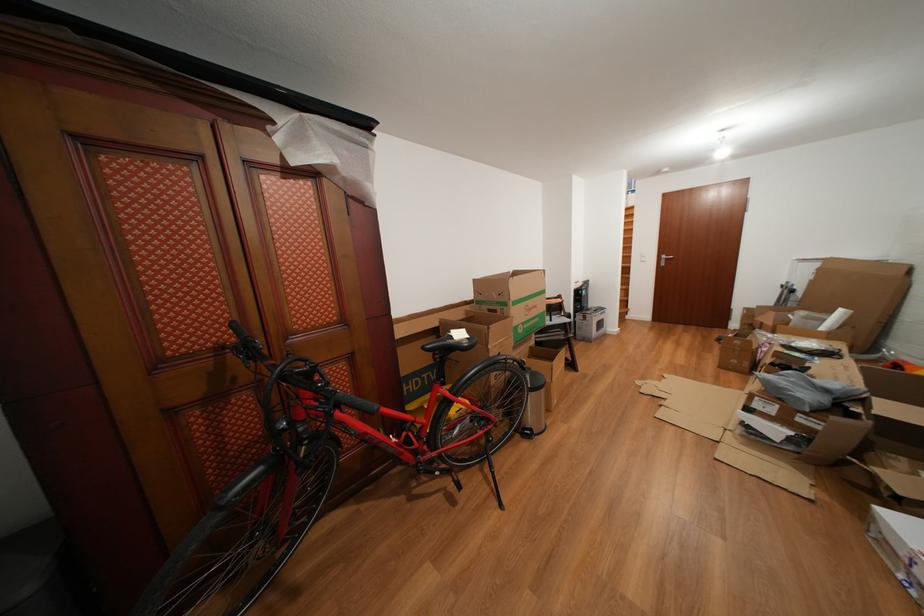
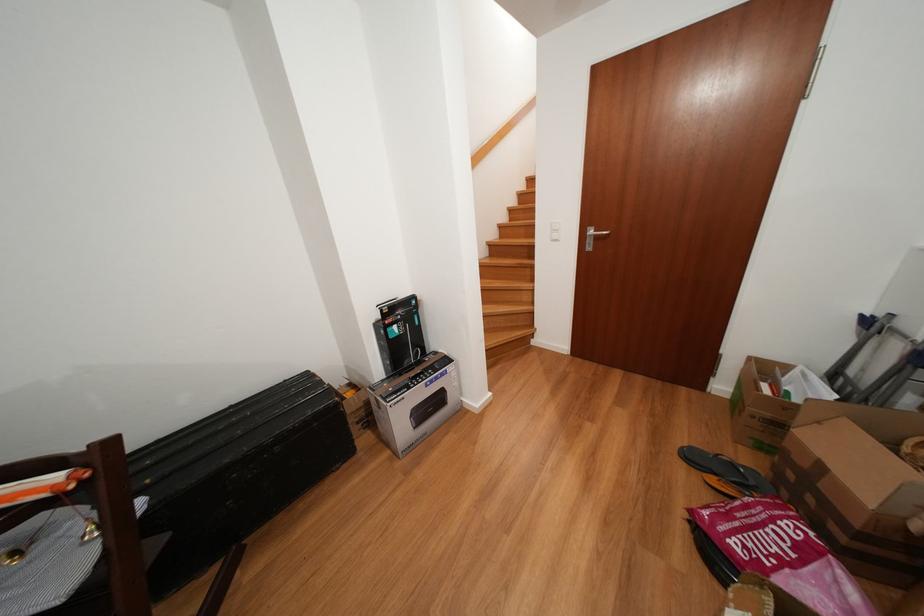
Which direction would the cameraman need to move to produce the second image?

The cameraman moved toward right, forward.